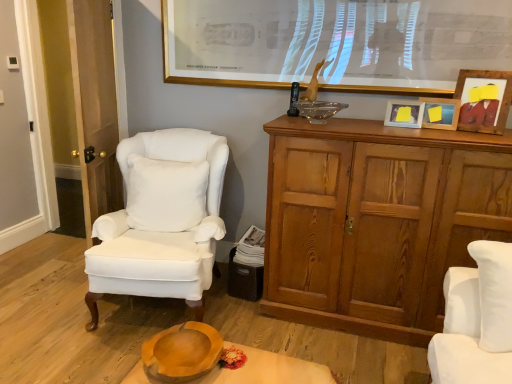
Question: Is white matte picture frame at upper right, which is the 2th picture frame in left-to-right order, smaller than white velvet pillow at center?

Choices:
 (A) no
 (B) yes

Answer: (B)

Question: Does white matte picture frame at upper right, positioned as the 3th picture frame in right-to-left order, have a lesser height compared to white velvet pillow at center?

Choices:
 (A) yes
 (B) no

Answer: (A)

Question: Would you say white velvet pillow at center is part of white matte picture frame at upper right, which is the 2th picture frame in left-to-right order,'s contents?

Choices:
 (A) no
 (B) yes

Answer: (A)

Question: Would you say white matte picture frame at upper right, which is the 2th picture frame in left-to-right order, is outside white velvet pillow at center?

Choices:
 (A) yes
 (B) no

Answer: (A)

Question: From a real-world perspective, is white matte picture frame at upper right, positioned as the 3th picture frame in right-to-left order, physically below white velvet pillow at center?

Choices:
 (A) no
 (B) yes

Answer: (A)

Question: From a real-world perspective, relative to gold-framed picture at upper center, placed as the 1th picture frame when sorted from left to right, is transparent glass bowl at upper center vertically above or below?

Choices:
 (A) above
 (B) below

Answer: (B)

Question: From the image's perspective, is transparent glass bowl at upper center located above or below gold-framed picture at upper center, placed as the 1th picture frame when sorted from left to right?

Choices:
 (A) above
 (B) below

Answer: (B)

Question: Considering the positions of transparent glass bowl at upper center and gold-framed picture at upper center, which appears as the fourth picture frame when viewed from the right, in the image, is transparent glass bowl at upper center taller or shorter than gold-framed picture at upper center, which appears as the fourth picture frame when viewed from the right,?

Choices:
 (A) tall
 (B) short

Answer: (B)

Question: Relative to gold-framed picture at upper center, placed as the 1th picture frame when sorted from left to right, is transparent glass bowl at upper center in front or behind?

Choices:
 (A) front
 (B) behind

Answer: (B)

Question: From a real-world perspective, is white matte picture frame at upper right, which is the 2th picture frame in left-to-right order, physically located above or below white fabric chair at left, which is the second chair in right-to-left order?

Choices:
 (A) below
 (B) above

Answer: (B)

Question: Does point (415, 107) appear closer or farther from the camera than point (198, 301)?

Choices:
 (A) farther
 (B) closer

Answer: (B)

Question: Is white matte picture frame at upper right, positioned as the 3th picture frame in right-to-left order, bigger or smaller than white fabric chair at left, which appears as the second chair when viewed from the front?

Choices:
 (A) big
 (B) small

Answer: (B)

Question: Is white matte picture frame at upper right, positioned as the 3th picture frame in right-to-left order, inside or outside of white fabric chair at left, which appears as the second chair when viewed from the front?

Choices:
 (A) inside
 (B) outside

Answer: (B)

Question: In the image, is transparent glass bowl at upper center on the left side or the right side of transparent glass door at left?

Choices:
 (A) right
 (B) left

Answer: (A)

Question: From the image's perspective, is transparent glass bowl at upper center above or below transparent glass door at left?

Choices:
 (A) above
 (B) below

Answer: (A)